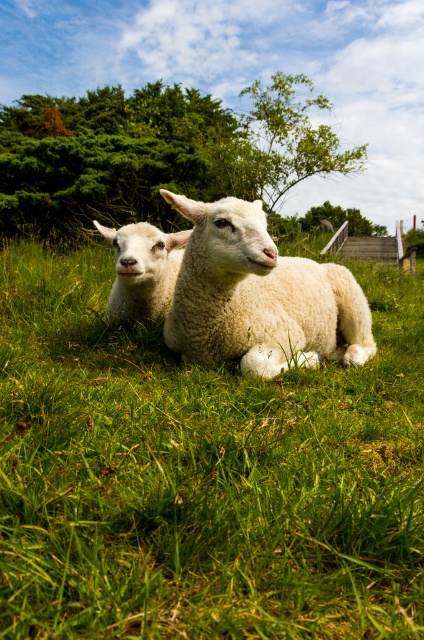
Question: Based on their relative distances, which object is farther from the white fluffy sheep at center?

Choices:
 (A) white woolen sheep at center
 (B) green soft grass at center

Answer: (A)

Question: Considering the real-world distances, which object is closest to the green soft grass at center?

Choices:
 (A) white fluffy sheep at center
 (B) white woolen sheep at center

Answer: (A)

Question: From the image, what is the correct spatial relationship of white fluffy sheep at center in relation to white woolen sheep at center?

Choices:
 (A) above
 (B) below

Answer: (B)

Question: Is green soft grass at center wider than white fluffy sheep at center?

Choices:
 (A) no
 (B) yes

Answer: (B)

Question: Which of the following is the farthest from the observer?

Choices:
 (A) (178, 595)
 (B) (195, 259)

Answer: (B)

Question: Does green soft grass at center have a greater width compared to white fluffy sheep at center?

Choices:
 (A) no
 (B) yes

Answer: (B)